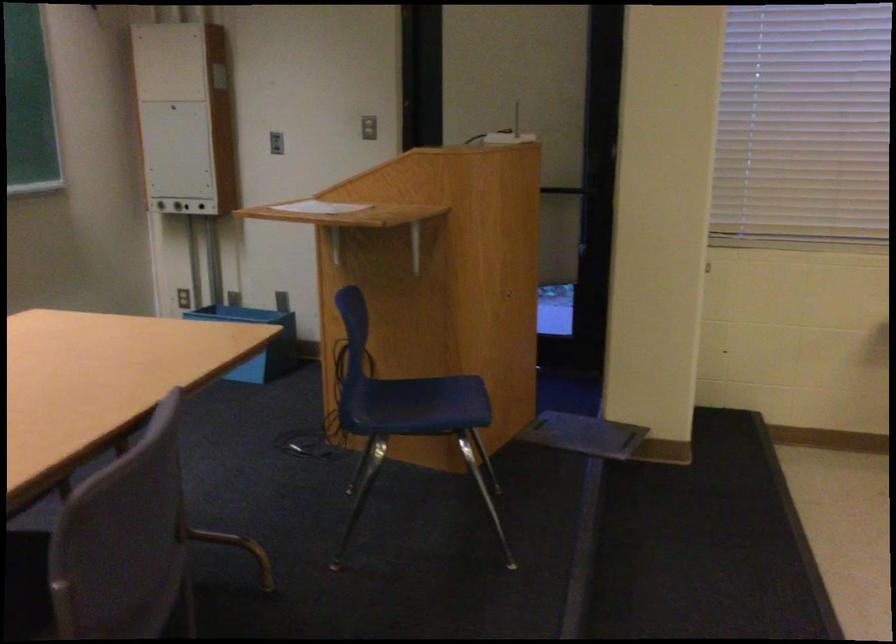
Describe the element at coordinates (26, 585) in the screenshot. Image resolution: width=896 pixels, height=644 pixels. I see `the gray chair sitting surface` at that location.